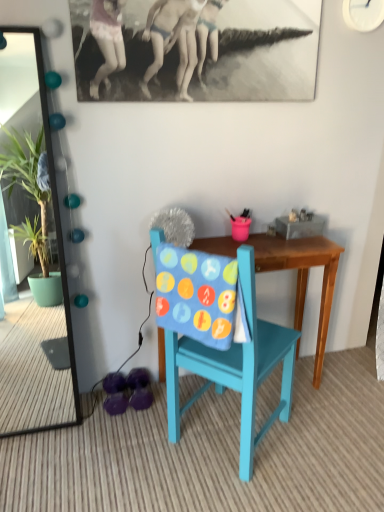
Question: Is the depth of green glossy mirror at left less than that of teal painted wood chair at center?

Choices:
 (A) yes
 (B) no

Answer: (B)

Question: Does green glossy mirror at left have a smaller size compared to teal painted wood chair at center?

Choices:
 (A) no
 (B) yes

Answer: (B)

Question: Is green glossy mirror at left taller than teal painted wood chair at center?

Choices:
 (A) no
 (B) yes

Answer: (B)

Question: Does green glossy mirror at left have a greater width compared to teal painted wood chair at center?

Choices:
 (A) no
 (B) yes

Answer: (A)

Question: Is teal painted wood chair at center located within green glossy mirror at left?

Choices:
 (A) no
 (B) yes

Answer: (A)

Question: Is green glossy mirror at left at the right side of teal painted wood chair at center?

Choices:
 (A) yes
 (B) no

Answer: (B)

Question: From the image's perspective, does wooden table at center appear lower than green glossy mirror at left?

Choices:
 (A) yes
 (B) no

Answer: (A)

Question: Is wooden table at center wider than green glossy mirror at left?

Choices:
 (A) no
 (B) yes

Answer: (B)

Question: Is wooden table at center further to the viewer compared to green glossy mirror at left?

Choices:
 (A) yes
 (B) no

Answer: (A)

Question: Is wooden table at center positioned beyond the bounds of green glossy mirror at left?

Choices:
 (A) yes
 (B) no

Answer: (A)

Question: From a real-world perspective, is wooden table at center on top of green glossy mirror at left?

Choices:
 (A) yes
 (B) no

Answer: (B)

Question: Is wooden table at center in contact with green glossy mirror at left?

Choices:
 (A) yes
 (B) no

Answer: (B)

Question: Is wooden table at center outside teal painted wood chair at center?

Choices:
 (A) yes
 (B) no

Answer: (A)